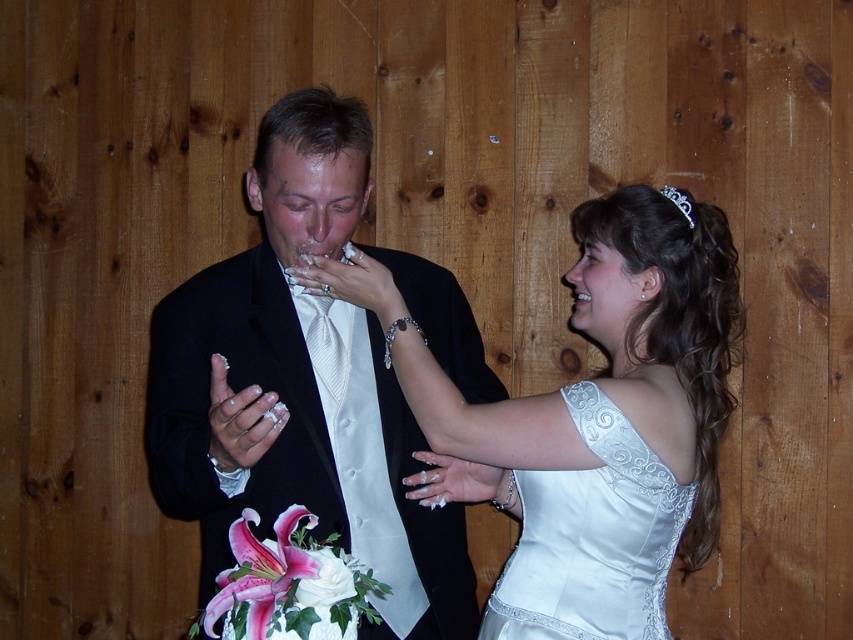
Question: Among these points, which one is farthest from the camera?

Choices:
 (A) (689, 216)
 (B) (344, 381)

Answer: (B)

Question: Does matte black suit at center lie behind satin white dress at center?

Choices:
 (A) yes
 (B) no

Answer: (B)

Question: Which object is positioned closest to the satin white dress at center?

Choices:
 (A) satin white dress at upper right
 (B) matte black suit at center

Answer: (A)

Question: Among these objects, which one is farthest from the camera?

Choices:
 (A) satin white dress at upper right
 (B) satin white dress at center

Answer: (B)

Question: Does matte black suit at center appear under satin white dress at upper right?

Choices:
 (A) no
 (B) yes

Answer: (A)

Question: Considering the relative positions of satin white dress at center and satin white dress at upper right in the image provided, where is satin white dress at center located with respect to satin white dress at upper right?

Choices:
 (A) left
 (B) right

Answer: (A)